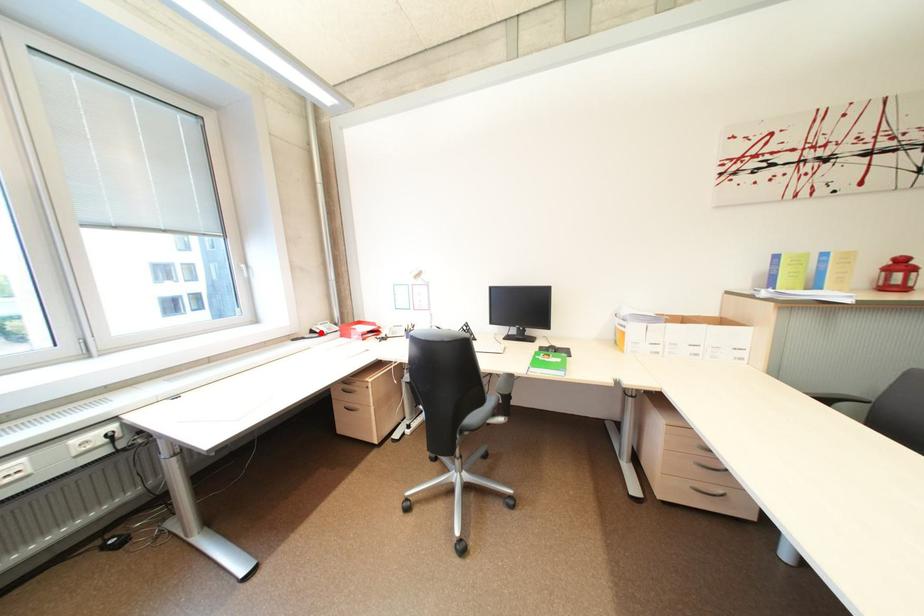
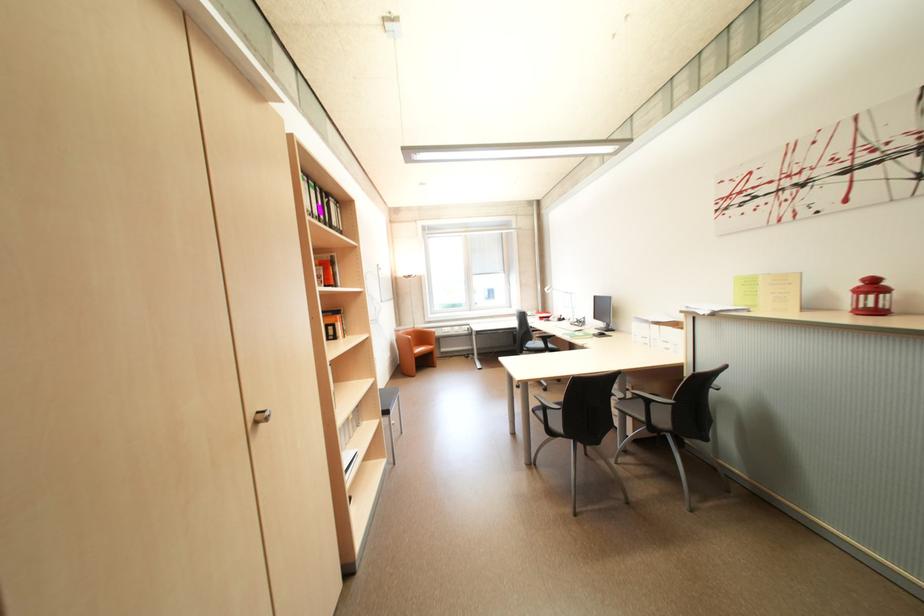
Question: I am providing you with two images of the same scene from different viewpoints. A red point is marked on the first image. Can you still see the location of the red point in image 2?

Choices:
 (A) Yes
 (B) No

Answer: (B)